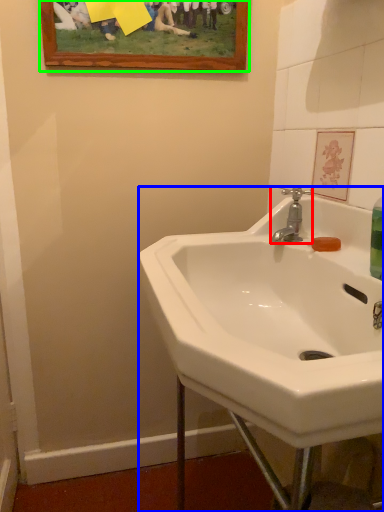
Question: Estimate the real-world distances between objects in this image. Which object is farther from tap (highlighted by a red box), sink (highlighted by a blue box) or picture frame (highlighted by a green box)?

Choices:
 (A) sink
 (B) picture frame

Answer: (B)